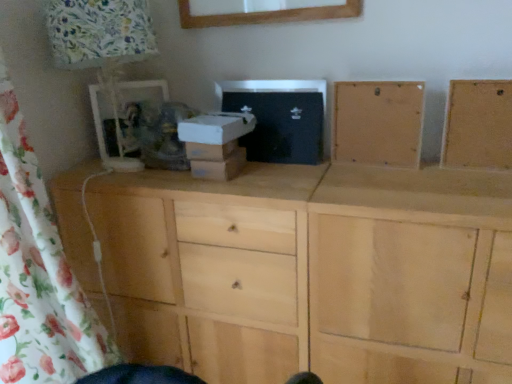
Question: Does floral fabric lampshade at left have a greater width compared to natural wood frame at upper right, which is the 1th cabinetry from right to left?

Choices:
 (A) yes
 (B) no

Answer: (A)

Question: Considering the relative sizes of floral fabric lampshade at left and natural wood frame at upper right, which is the 1th cabinetry from right to left, in the image provided, is floral fabric lampshade at left smaller than natural wood frame at upper right, which is the 1th cabinetry from right to left,?

Choices:
 (A) yes
 (B) no

Answer: (B)

Question: Does floral fabric lampshade at left lie in front of natural wood frame at upper right, which is the 1th cabinetry from right to left?

Choices:
 (A) yes
 (B) no

Answer: (A)

Question: Could you tell me if floral fabric lampshade at left is facing natural wood frame at upper right, which is the 1th cabinetry from right to left?

Choices:
 (A) yes
 (B) no

Answer: (B)

Question: Is there a large distance between floral fabric lampshade at left and natural wood frame at upper right, which is the 1th cabinetry from right to left?

Choices:
 (A) yes
 (B) no

Answer: (B)

Question: From the image's perspective, relative to white cardboard box at center, is natural wood frame at upper right, which is the 1th cabinetry from right to left, above or below?

Choices:
 (A) below
 (B) above

Answer: (B)

Question: From a real-world perspective, relative to white cardboard box at center, is natural wood frame at upper right, which is the 1th cabinetry from right to left, vertically above or below?

Choices:
 (A) above
 (B) below

Answer: (A)

Question: Is natural wood frame at upper right, positioned as the second cabinetry in left-to-right order, spatially inside white cardboard box at center, or outside of it?

Choices:
 (A) inside
 (B) outside

Answer: (B)

Question: From their relative heights in the image, would you say natural wood frame at upper right, which is the 1th cabinetry from right to left, is taller or shorter than white cardboard box at center?

Choices:
 (A) short
 (B) tall

Answer: (B)

Question: Is light wood cabinet at center, the first cabinetry positioned from the left, taller or shorter than floral fabric lampshade at left?

Choices:
 (A) short
 (B) tall

Answer: (A)

Question: From the image's perspective, is light wood cabinet at center, the first cabinetry positioned from the left, located above or below floral fabric lampshade at left?

Choices:
 (A) below
 (B) above

Answer: (A)

Question: In terms of width, does light wood cabinet at center, arranged as the 2th cabinetry when viewed from the right, look wider or thinner when compared to floral fabric lampshade at left?

Choices:
 (A) wide
 (B) thin

Answer: (B)

Question: From a real-world perspective, is light wood cabinet at center, the first cabinetry positioned from the left, positioned above or below floral fabric lampshade at left?

Choices:
 (A) above
 (B) below

Answer: (B)

Question: In the image, is light wood cabinet at center, the first cabinetry positioned from the left, on the left side or the right side of white cardboard box at center?

Choices:
 (A) left
 (B) right

Answer: (B)

Question: Is light wood cabinet at center, arranged as the 2th cabinetry when viewed from the right, bigger or smaller than white cardboard box at center?

Choices:
 (A) small
 (B) big

Answer: (A)